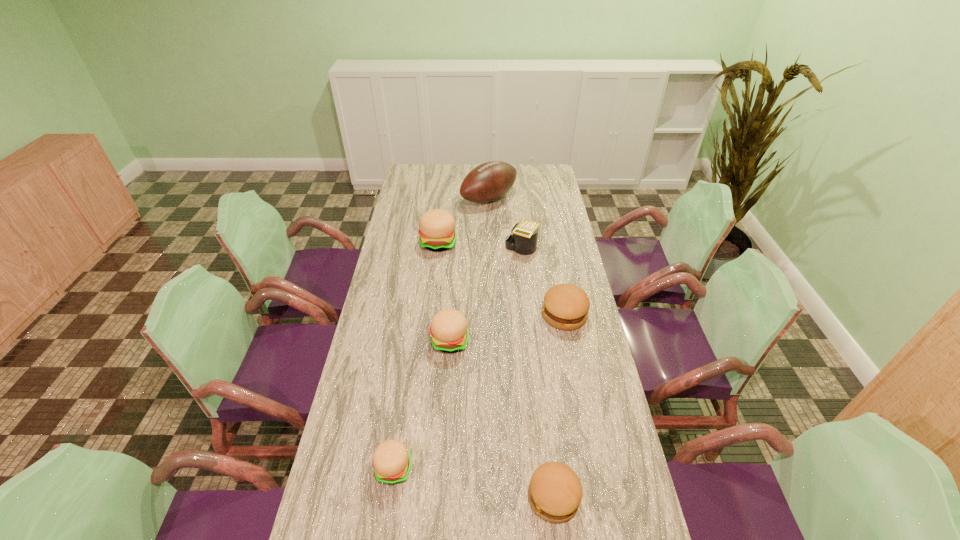
Where is `the farthest object`? The height and width of the screenshot is (540, 960). the farthest object is located at coordinates (489, 181).

Locate an element on the screen. This screenshot has height=540, width=960. football (American) is located at coordinates (489, 181).

Identify the location of the second tallest object. (437, 232).

The image size is (960, 540). Identify the location of the farthest hamburger. (437, 232).

Locate an element on the screen. The width and height of the screenshot is (960, 540). the second biggest beige hamburger is located at coordinates (449, 333).

I want to click on the bigger brown hamburger, so click(565, 306).

I want to click on calculator, so click(x=523, y=241).

You are a GUI agent. You are given a task and a screenshot of the screen. Output one action in this format:
    pyautogui.click(x=<x>, y=<y>)
    Task: Click on the smaller brown hamburger
    
    Given the screenshot: What is the action you would take?
    pyautogui.click(x=555, y=491)

What are the coordinates of `the smallest beige hamburger` in the screenshot? It's located at (392, 461).

Where is `free region located on the right of the football (American)`? Image resolution: width=960 pixels, height=540 pixels. free region located on the right of the football (American) is located at coordinates (558, 198).